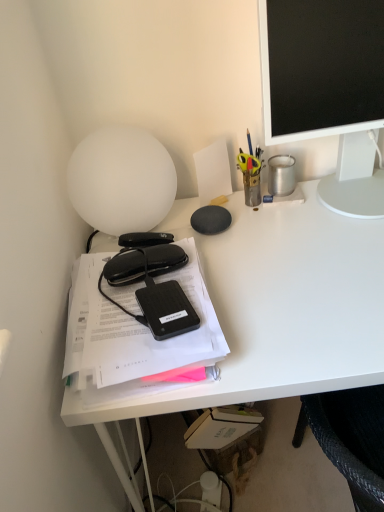
The height and width of the screenshot is (512, 384). What are the coordinates of `vacant point to the right of white matte lamp at upper left` in the screenshot? It's located at (219, 238).